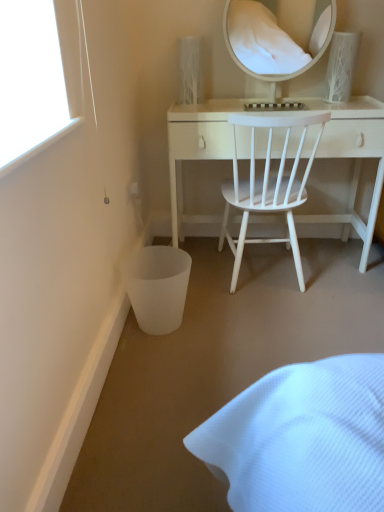
Where is `white glossy mirror at upper center`? This screenshot has width=384, height=512. white glossy mirror at upper center is located at coordinates (271, 40).

The height and width of the screenshot is (512, 384). I want to click on white textured vase at upper right, so [x=341, y=66].

The width and height of the screenshot is (384, 512). I want to click on white wood chair at center, so click(268, 185).

Is white wood chair at center wider or thinner than white glossy mirror at upper center?

white wood chair at center is wider than white glossy mirror at upper center.

Is white wood chair at center far away from white glossy mirror at upper center?

white wood chair at center is positioned a significant distance from white glossy mirror at upper center.

Which object is positioned more to the right, white wood chair at center or white glossy mirror at upper center?

white glossy mirror at upper center is more to the right.

Which object is wider, white matte wood desk at center or white textured vase at upper right?

Wider between the two is white matte wood desk at center.

Could you tell me if white matte wood desk at center is turned towards white textured vase at upper right?

No, white matte wood desk at center does not turn towards white textured vase at upper right.

From a real-world perspective, does white matte wood desk at center stand above white textured vase at upper right?

No, from a real-world perspective, white matte wood desk at center is not over white textured vase at upper right

Considering the relative sizes of white matte wood desk at center and white textured vase at upper right in the image provided, is white matte wood desk at center shorter than white textured vase at upper right?

No, white matte wood desk at center is not shorter than white textured vase at upper right.

Is white glossy mirror at upper center located outside white matte wood desk at center?

Yes.

Considering the points (248, 37) and (329, 134), which point is behind, point (248, 37) or point (329, 134)?

The point (248, 37) is farther.

Can you confirm if white glossy mirror at upper center is bigger than white matte wood desk at center?

No, white glossy mirror at upper center is not bigger than white matte wood desk at center.

Is white glossy mirror at upper center next to white matte wood desk at center and touching it?

No, white glossy mirror at upper center is not with white matte wood desk at center.

Who is shorter, white matte wood desk at center or white wood chair at center?

With less height is white matte wood desk at center.

Based on the photo, is white matte wood desk at center oriented away from white wood chair at center?

Yes, white matte wood desk at center is facing away from white wood chair at center.

Is white wood chair at center positioned with its back to white textured vase at upper right?

No.

Can you confirm if white wood chair at center is taller than white textured vase at upper right?

Correct, white wood chair at center is much taller as white textured vase at upper right.

Would you consider white wood chair at center to be distant from white textured vase at upper right?

No, white wood chair at center is not far from white textured vase at upper right.

Does white textured vase at upper right have a lesser width compared to white wood chair at center?

Indeed, white textured vase at upper right has a lesser width compared to white wood chair at center.

Looking at this image, considering the sizes of white textured vase at upper right and white wood chair at center in the image, is white textured vase at upper right taller or shorter than white wood chair at center?

Considering their sizes, white textured vase at upper right has less height than white wood chair at center.

The image size is (384, 512). What are the coordinates of `chair located underneath the white textured vase at upper right (from a real-world perspective)` in the screenshot? It's located at (268, 185).

Is white wood chair at center at the right side of white matte wood desk at center?

No.

From the image's perspective, is white wood chair at center on top of white matte wood desk at center?

No, from the image's perspective, white wood chair at center is not over white matte wood desk at center.

From a real-world perspective, does white wood chair at center stand above white matte wood desk at center?

Yes, from a real-world perspective, white wood chair at center is on top of white matte wood desk at center.

Does white wood chair at center have a lesser height compared to white matte wood desk at center?

No, white wood chair at center is not shorter than white matte wood desk at center.

Locate an element on the screen. This screenshot has width=384, height=512. chair below the white glossy mirror at upper center (from the image's perspective) is located at coordinates (268, 185).

Where is `desk located on the left of white textured vase at upper right`? desk located on the left of white textured vase at upper right is located at coordinates (352, 158).

Looking at the image, which one is located further to white matte wood desk at center, white textured vase at upper right or white glossy mirror at upper center?

white glossy mirror at upper center.

Looking at the image, which one is located closer to white textured vase at upper right, white glossy mirror at upper center or white matte wood desk at center?

white matte wood desk at center.

When comparing their distances from white wood chair at center, does white glossy mirror at upper center or white textured vase at upper right seem closer?

The object closer to white wood chair at center is white textured vase at upper right.

Estimate the real-world distances between objects in this image. Which object is further from white textured vase at upper right, white glossy mirror at upper center or white wood chair at center?

→ The object further to white textured vase at upper right is white glossy mirror at upper center.

Looking at the image, which one is located closer to white textured vase at upper right, white matte wood desk at center or white wood chair at center?

Based on the image, white matte wood desk at center appears to be nearer to white textured vase at upper right.

Based on their spatial positions, is white matte wood desk at center or white glossy mirror at upper center closer to white wood chair at center?

Among the two, white matte wood desk at center is located nearer to white wood chair at center.

Based on their spatial positions, is white matte wood desk at center or white wood chair at center closer to white glossy mirror at upper center?

white matte wood desk at center is positioned closer to the anchor white glossy mirror at upper center.

When comparing their distances from white matte wood desk at center, does white wood chair at center or white textured vase at upper right seem closer?

white wood chair at center is positioned closer to the anchor white matte wood desk at center.

Locate an element on the screen. This screenshot has height=512, width=384. table lamp between white glossy mirror at upper center and white wood chair at center in the vertical direction is located at coordinates (341, 66).

The width and height of the screenshot is (384, 512). I want to click on desk between white textured vase at upper right and white wood chair at center in the vertical direction, so click(352, 158).

Locate an element on the screen. The height and width of the screenshot is (512, 384). desk between white glossy mirror at upper center and white wood chair at center in the up-down direction is located at coordinates (352, 158).

The height and width of the screenshot is (512, 384). I want to click on table lamp that lies between white glossy mirror at upper center and white matte wood desk at center from top to bottom, so click(x=341, y=66).